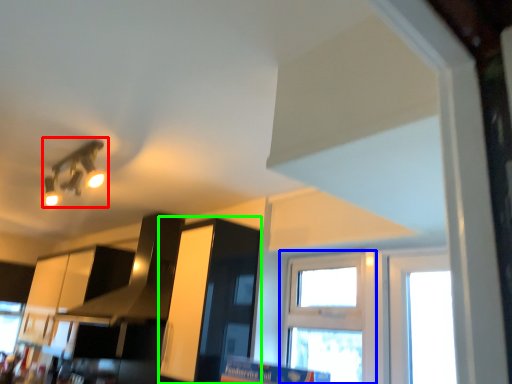
Question: Based on their relative distances, which object is farther from light fixture (highlighted by a red box)? Choose from window (highlighted by a blue box) and cabinetry (highlighted by a green box).

Choices:
 (A) window
 (B) cabinetry

Answer: (A)